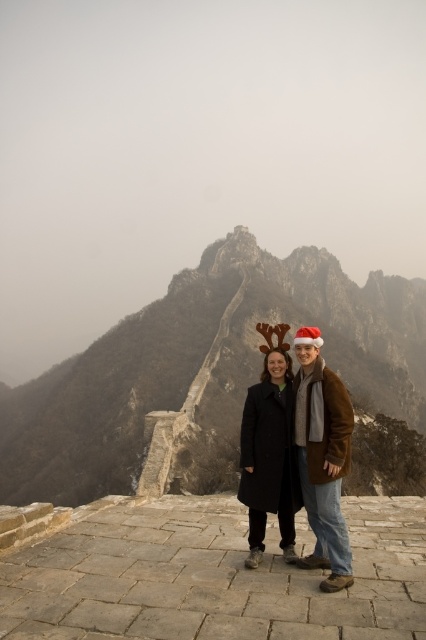
In the scene shown: You are a photographer planning to take a photo of the rugged stone wall at center and the matte black coat at center. Based on their positions, which object should you focus on first to ensure both are in sharp focus?

The rugged stone wall at center is closer to the photographer than the matte black coat at center. To ensure both are in sharp focus, focus on the rugged stone wall at center first.

You are a photographer planning to take a photo of the rugged stone wall at center and the matte black coat at center. Based on their positions, which object should you focus on first to ensure both are in frame?

The rugged stone wall at center is positioned on the right side of matte black coat at center. Therefore, you should focus on the matte black coat at center first, as it is closer to the left side, ensuring both remain in frame.